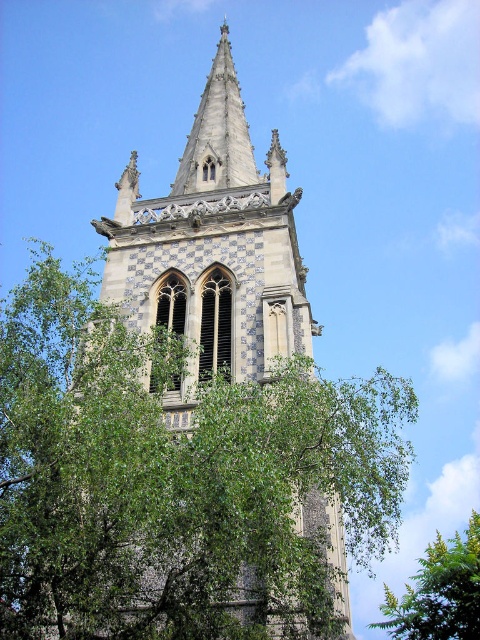
Question: In this image, where is white checkered stone tower at center located relative to green leafy tree at lower right?

Choices:
 (A) above
 (B) below

Answer: (A)

Question: Is white checkered stone tower at center bigger than green leafy tree at lower right?

Choices:
 (A) no
 (B) yes

Answer: (A)

Question: Does white checkered stone tower at center have a smaller size compared to green leafy tree at lower right?

Choices:
 (A) yes
 (B) no

Answer: (A)

Question: Which point is closer to the camera taking this photo?

Choices:
 (A) (417, 576)
 (B) (201, 204)

Answer: (B)